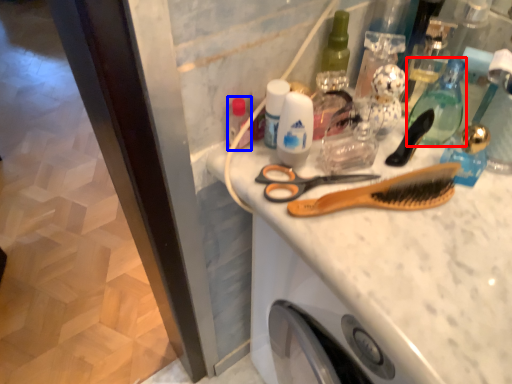
Question: Which of the following is the closest to the observer, mouthwash (highlighted by a red box) or toiletry (highlighted by a blue box)?

Choices:
 (A) mouthwash
 (B) toiletry

Answer: (A)